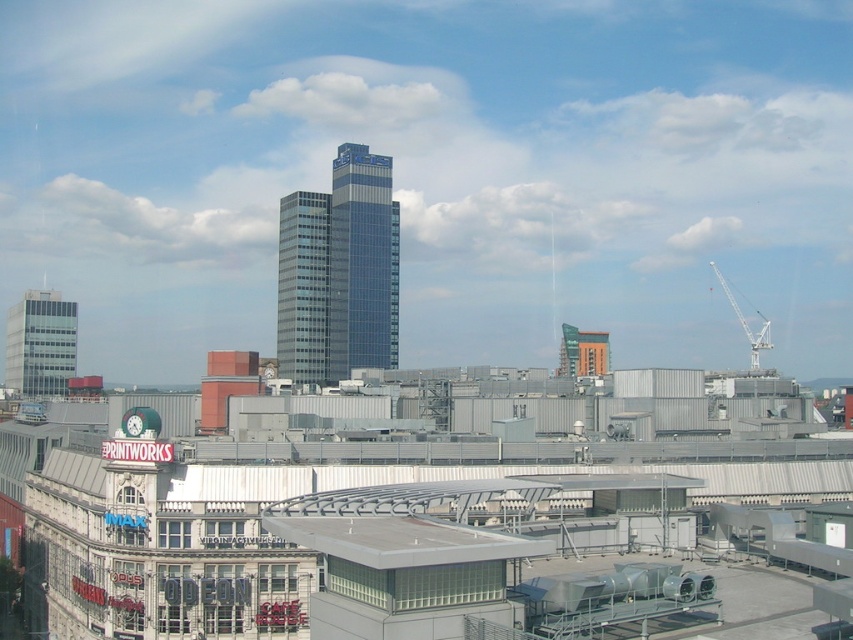
Between matte glass skyscraper at center and white metallic crane at upper right, which one has less height?

white metallic crane at upper right is shorter.

Does point (312, 285) lie behind point (750, 346)?

No, it is not.

Does point (322, 333) come behind point (753, 353)?

Yes, it is.

Locate an element on the screen. matte glass skyscraper at center is located at coordinates (303, 288).

Which of these two, glassy blue skyscraper at center or matte glass skyscraper at center, stands taller?

glassy blue skyscraper at center is taller.

Who is more forward, [283,198] or [308,257]?

Positioned in front is point [308,257].

The height and width of the screenshot is (640, 853). In order to click on glassy blue skyscraper at center in this screenshot , I will do `click(338, 273)`.

Which is in front, point (320, 243) or point (598, 368)?

Point (598, 368) is in front.

Between matte glass skyscraper at center and orange brick building at center, which one has less height?

With less height is orange brick building at center.

The width and height of the screenshot is (853, 640). I want to click on matte glass skyscraper at center, so click(303, 288).

Where is `matte glass skyscraper at center`? matte glass skyscraper at center is located at coordinates (303, 288).